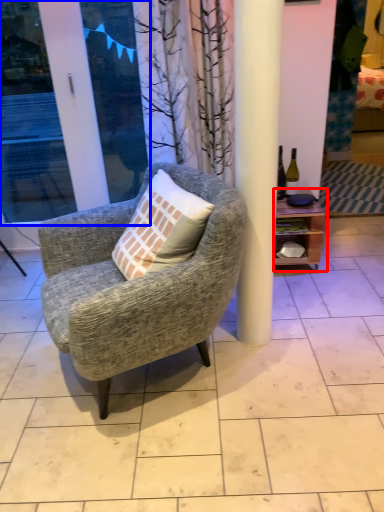
Question: Among these objects, which one is farthest to the camera, shelf (highlighted by a red box) or screen door (highlighted by a blue box)?

Choices:
 (A) shelf
 (B) screen door

Answer: (A)